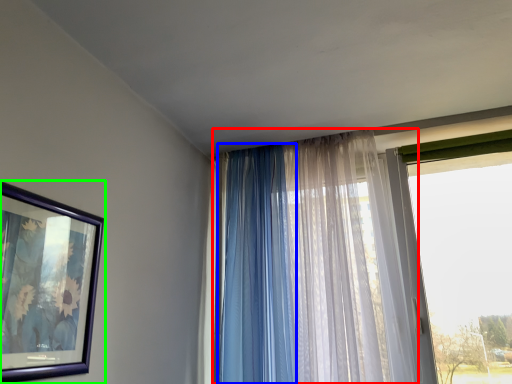
Question: Considering the real-world distances, which object is farthest from curtain (highlighted by a red box)? curtain (highlighted by a blue box) or picture frame (highlighted by a green box)?

Choices:
 (A) curtain
 (B) picture frame

Answer: (B)